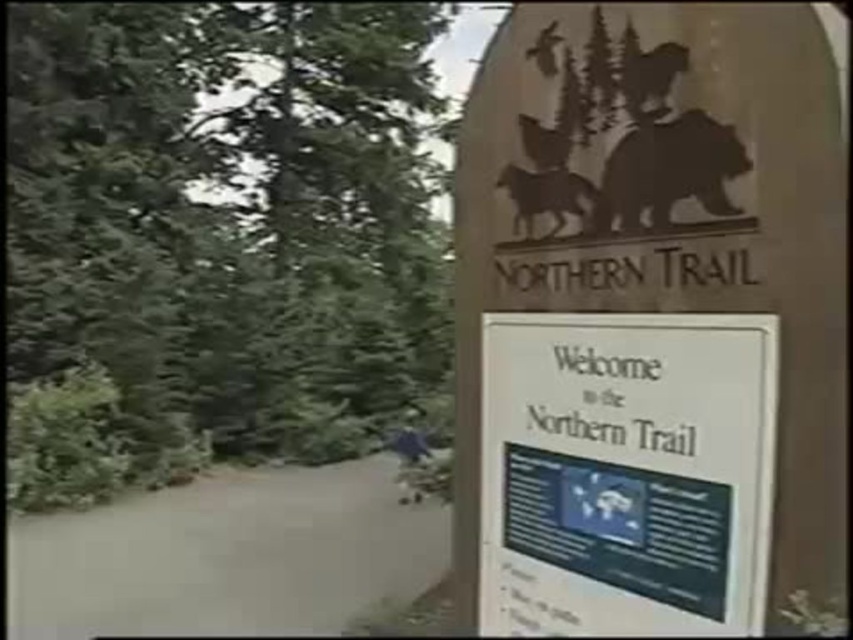
In the scene shown: You are a hiker who just arrived at the Northern Trail signboard. You notice two animals depicted on the signboard. Which one is bigger between the brown matte horse at upper center and the brown matte bear at upper center?

The brown matte horse at upper center is larger compared to the brown matte bear at upper center according to the signboard.